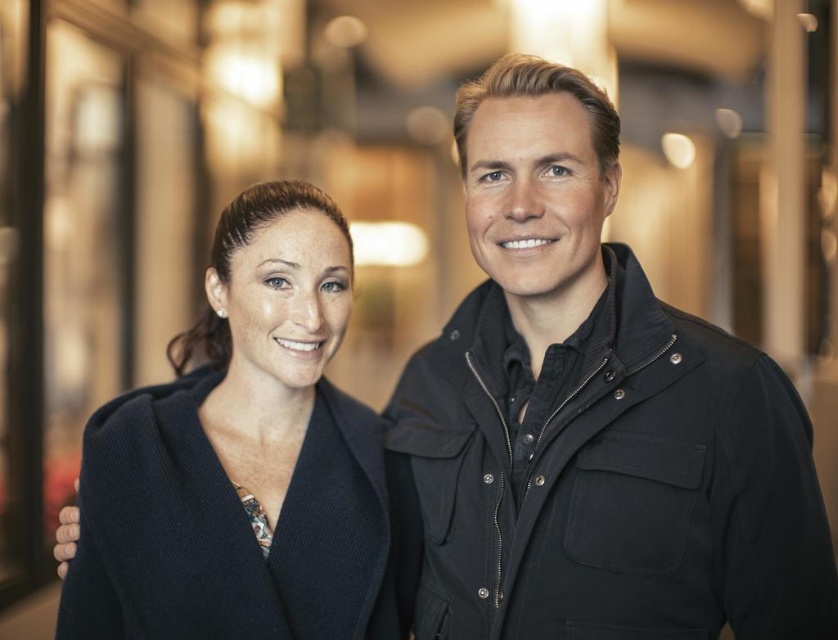
Question: Can you confirm if black matte jacket at center is wider than matte black coat at left?

Choices:
 (A) yes
 (B) no

Answer: (A)

Question: Does black matte jacket at center have a larger size compared to matte black coat at left?

Choices:
 (A) no
 (B) yes

Answer: (B)

Question: Which object appears closest to the camera in this image?

Choices:
 (A) matte black coat at left
 (B) black matte jacket at center

Answer: (B)

Question: Can you confirm if black matte jacket at center is thinner than matte black coat at left?

Choices:
 (A) no
 (B) yes

Answer: (A)